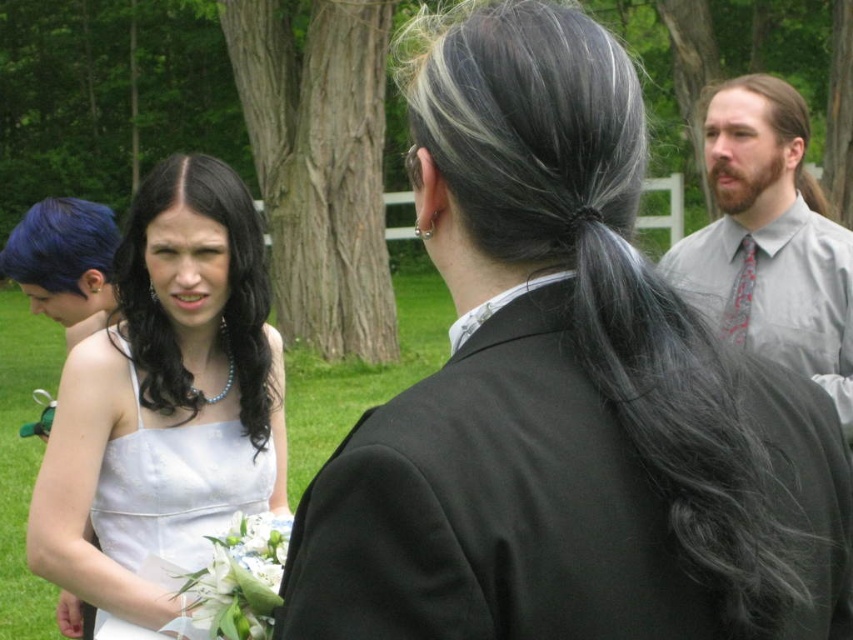
Question: Which point is closer to the camera taking this photo?

Choices:
 (A) (21, 259)
 (B) (212, 289)

Answer: (B)

Question: From the image, what is the correct spatial relationship of white satin dress at left in relation to black shiny hair at left?

Choices:
 (A) below
 (B) above

Answer: (A)

Question: Which point is farther to the camera?

Choices:
 (A) (167, 492)
 (B) (546, 28)
 (C) (809, 269)
 (D) (744, 250)

Answer: (D)

Question: Does gray shirt with tie at upper right have a lesser width compared to black shiny hair at left?

Choices:
 (A) no
 (B) yes

Answer: (A)

Question: Is white satin dress at left positioned in front of blue matte hair at left?

Choices:
 (A) no
 (B) yes

Answer: (B)

Question: Which object appears farthest from the camera in this image?

Choices:
 (A) blue matte hair at left
 (B) black silky hair at upper center
 (C) brown matte hair at upper right

Answer: (C)